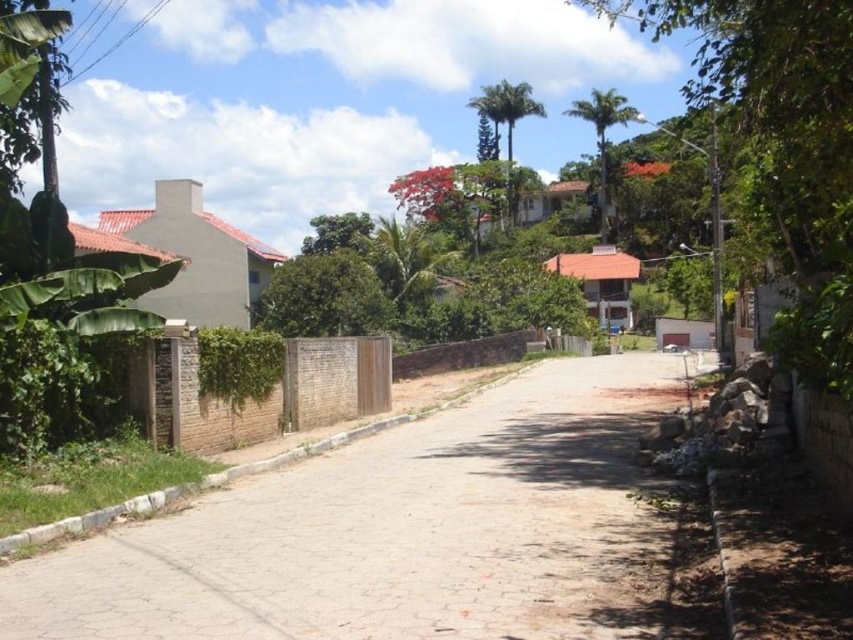
In the scene shown: Which is more to the right, green leafy tree at upper right or green leafy palm tree at center?

green leafy tree at upper right is more to the right.

Between green leafy tree at upper right and green leafy palm tree at center, which one is positioned lower?

green leafy tree at upper right is lower down.

Measure the distance between green leafy tree at upper right and camera.

They are 6.22 meters apart.

This screenshot has height=640, width=853. In order to click on green leafy tree at upper right in this screenshot , I will do `click(782, 145)`.

Can you confirm if green leafy tree at upper right is taller than green leafy palm tree at upper center?

Correct, green leafy tree at upper right is much taller as green leafy palm tree at upper center.

Does point (822, 160) lie behind point (590, 104)?

No, it is not.

Where is `green leafy tree at upper right`? green leafy tree at upper right is located at coordinates (782, 145).

Describe the element at coordinates (404, 532) in the screenshot. I see `dirt road at center` at that location.

Can you confirm if dirt road at center is shorter than green leafy palm tree at upper center?

Yes, dirt road at center is shorter than green leafy palm tree at upper center.

Is point (215, 504) positioned before point (618, 115)?

Yes, it is in front of point (618, 115).

Locate an element on the screen. This screenshot has height=640, width=853. dirt road at center is located at coordinates (404, 532).